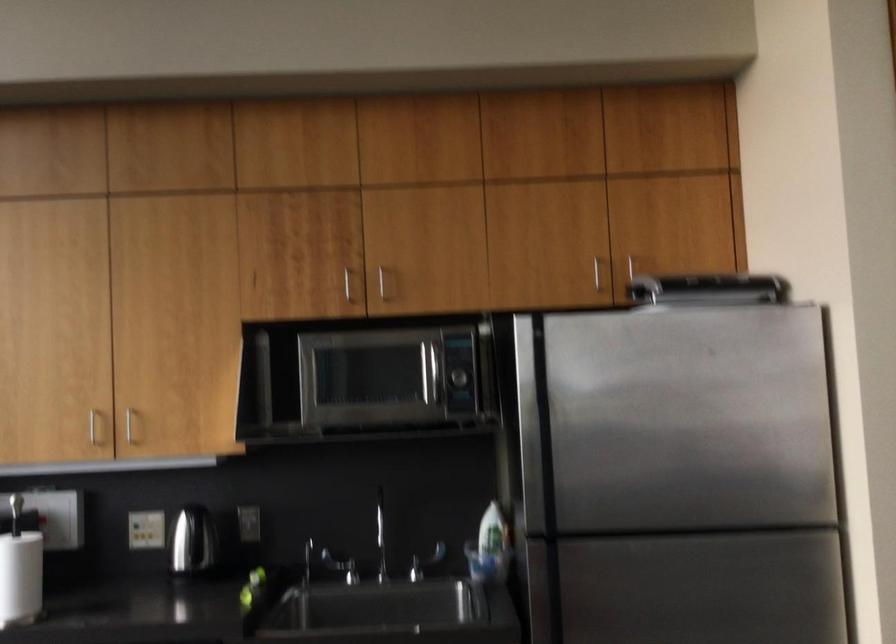
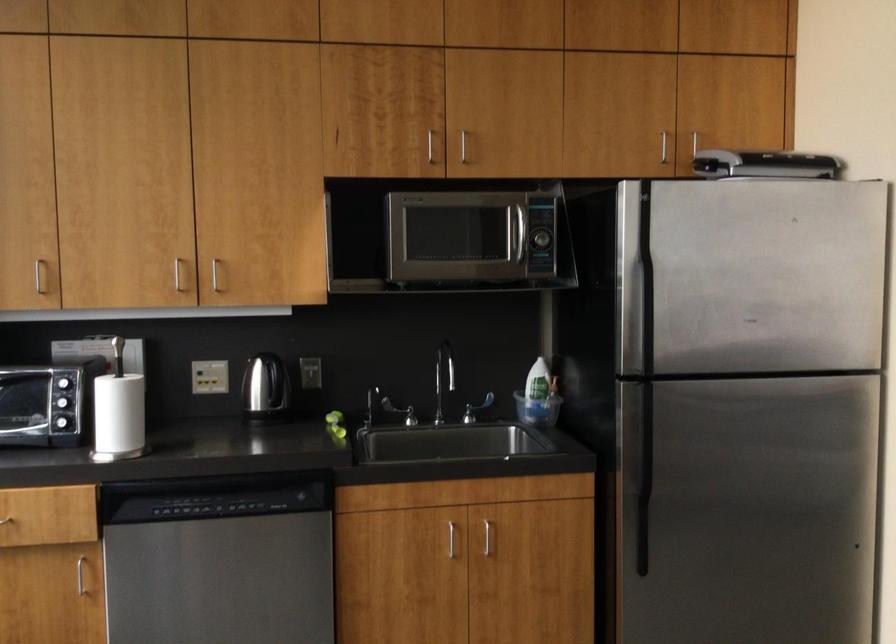
In the second image, find the point that corresponds to the point at 688,286 in the first image.

(764, 164)